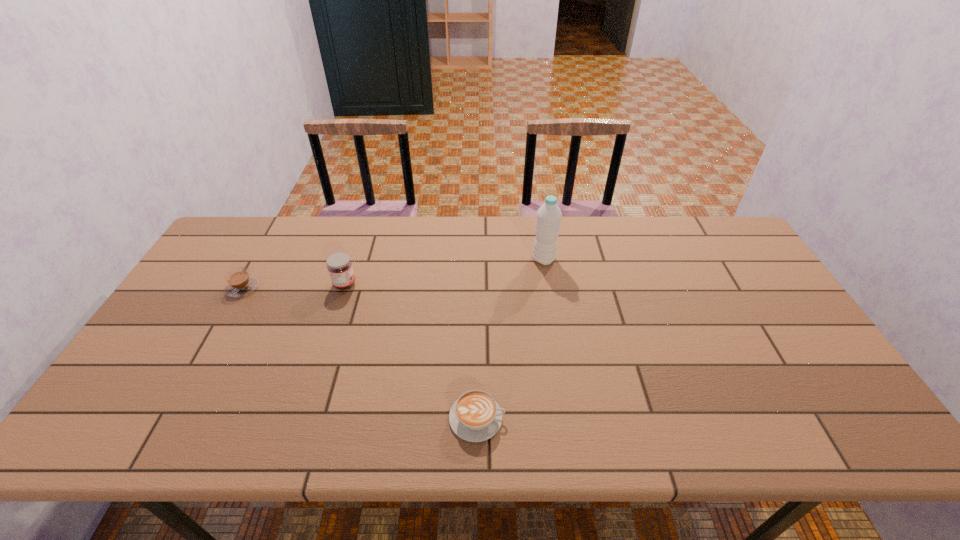
Where is `blank region between the water bottle and the shorter cappuccino`? This screenshot has width=960, height=540. blank region between the water bottle and the shorter cappuccino is located at coordinates (511, 339).

At what (x,y) coordinates should I click in order to perform the action: click on free spot between the third shortest object and the rightmost object. Please return your answer as a coordinate pair (x, y). Looking at the image, I should click on (444, 272).

The width and height of the screenshot is (960, 540). Find the location of `vacant space in between the nearer cappuccino and the taller cappuccino`. vacant space in between the nearer cappuccino and the taller cappuccino is located at coordinates (360, 353).

The image size is (960, 540). In order to click on vacant space that is in between the right cappuccino and the rightmost object in this screenshot , I will do `click(511, 339)`.

Identify the location of free space that is in between the jam and the shortest object. The height and width of the screenshot is (540, 960). (411, 351).

Identify the location of blank region between the taller cappuccino and the shortest object. (360, 353).

Where is `vacant region between the water bottle and the taller cappuccino`? The height and width of the screenshot is (540, 960). vacant region between the water bottle and the taller cappuccino is located at coordinates (394, 273).

Find the location of a particular element. Image resolution: width=960 pixels, height=540 pixels. free area in between the jam and the rightmost object is located at coordinates (444, 272).

Find the location of `free space between the shorter cappuccino and the third tallest object`. free space between the shorter cappuccino and the third tallest object is located at coordinates (360, 353).

The image size is (960, 540). Find the location of `vacant point located between the rightmost object and the third shortest object`. vacant point located between the rightmost object and the third shortest object is located at coordinates (444, 272).